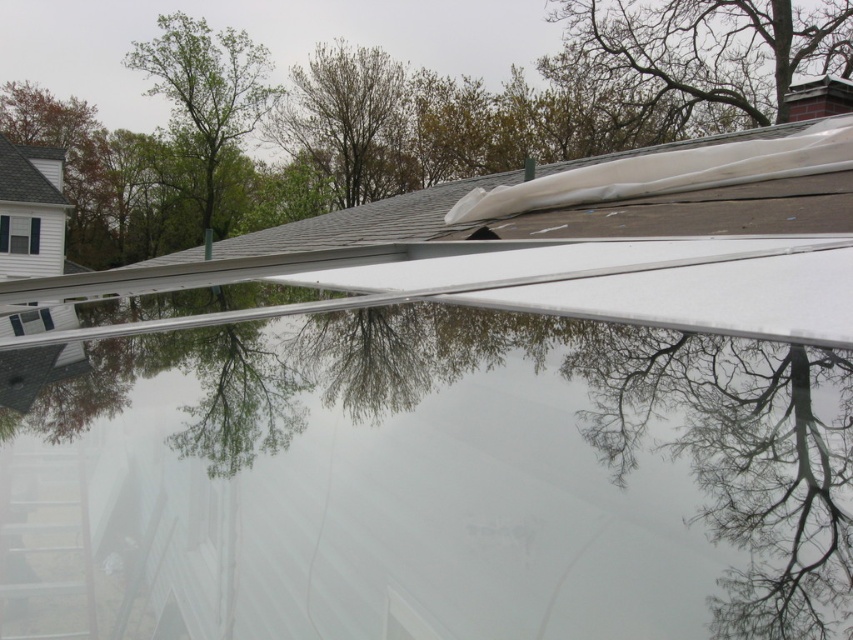
Question: Among these points, which one is farthest from the camera?

Choices:
 (A) (434, 205)
 (B) (755, 74)
 (C) (260, 99)

Answer: (C)

Question: Which point is closer to the camera?

Choices:
 (A) (735, 136)
 (B) (155, 298)
 (C) (405, 147)

Answer: (B)

Question: Does transparent glass water at center have a lesser width compared to gray shingles at upper center?

Choices:
 (A) no
 (B) yes

Answer: (B)

Question: Can you confirm if green leafy tree at upper center is bigger than gray shingles at upper center?

Choices:
 (A) yes
 (B) no

Answer: (B)

Question: Does transparent glass water at center appear on the right side of gray shingles at upper left?

Choices:
 (A) yes
 (B) no

Answer: (A)

Question: Which point is farther from the camera taking this photo?

Choices:
 (A) (252, 96)
 (B) (36, 177)

Answer: (A)